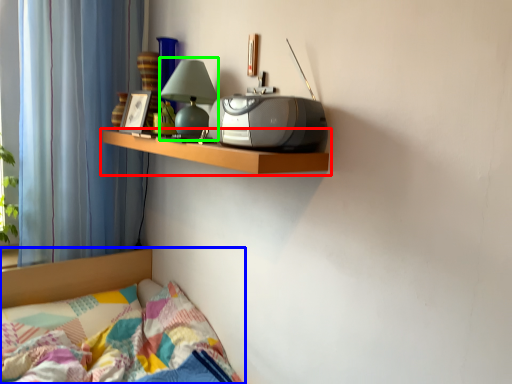
Question: Which is nearer to the shelf (highlighted by a red box)? bed (highlighted by a blue box) or table lamp (highlighted by a green box).

Choices:
 (A) bed
 (B) table lamp

Answer: (B)